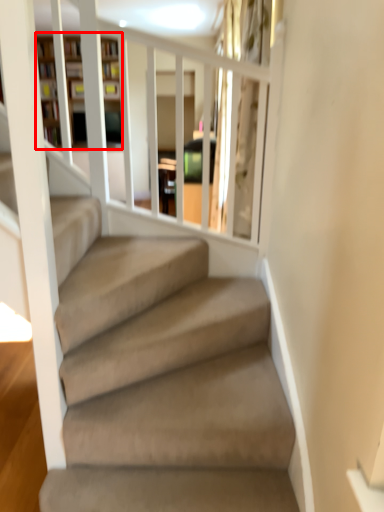
Question: From the image's perspective, what is the correct spatial relationship of bookshelf (annotated by the red box) in relation to glass door?

Choices:
 (A) below
 (B) above

Answer: (B)